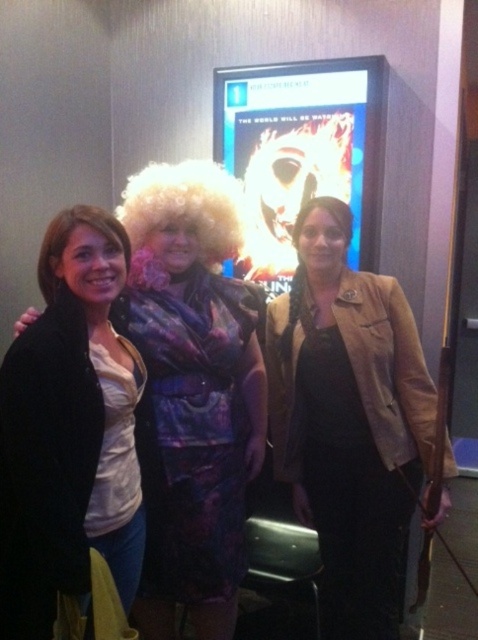
Question: Can you confirm if tan leather jacket at center is positioned to the right of blonde synthetic wig at left?

Choices:
 (A) yes
 (B) no

Answer: (A)

Question: Which point is closer to the camera?

Choices:
 (A) (315, 186)
 (B) (66, 321)
 (C) (347, 220)
 (D) (76, 212)

Answer: (B)

Question: Based on their relative distances, which object is nearer to the matte black jacket at left?

Choices:
 (A) blonde synthetic wig at left
 (B) shiny purple dress at center
 (C) blonde curly wig at center
 (D) tan leather jacket at center

Answer: (A)

Question: Can you confirm if metallic silver poster at center is positioned to the right of blonde synthetic wig at left?

Choices:
 (A) yes
 (B) no

Answer: (A)

Question: Is curly blonde wig at center positioned in front of blonde curly wig at center?

Choices:
 (A) yes
 (B) no

Answer: (A)

Question: Which object is farther from the camera taking this photo?

Choices:
 (A) blonde curly wig at center
 (B) tan leather jacket at center
 (C) matte black jacket at left

Answer: (A)